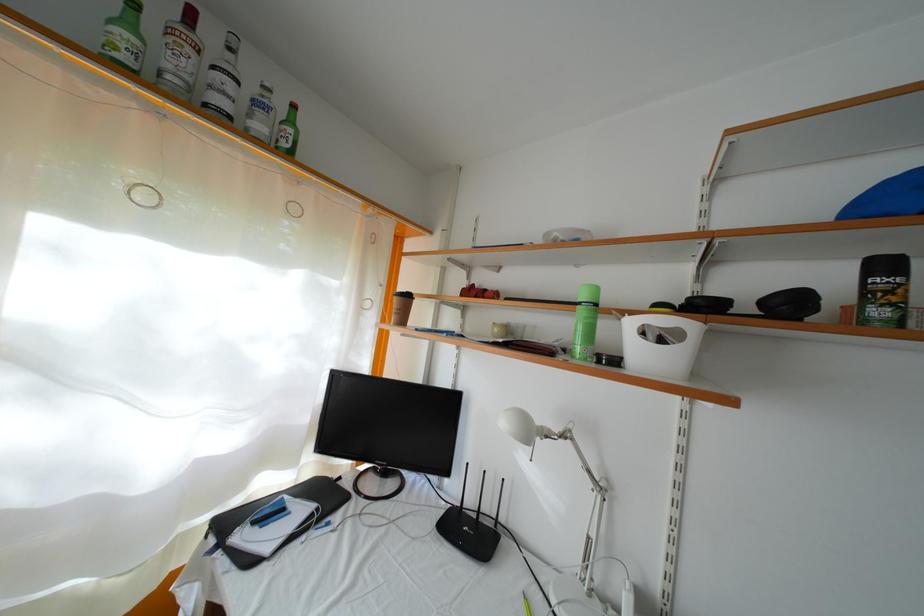
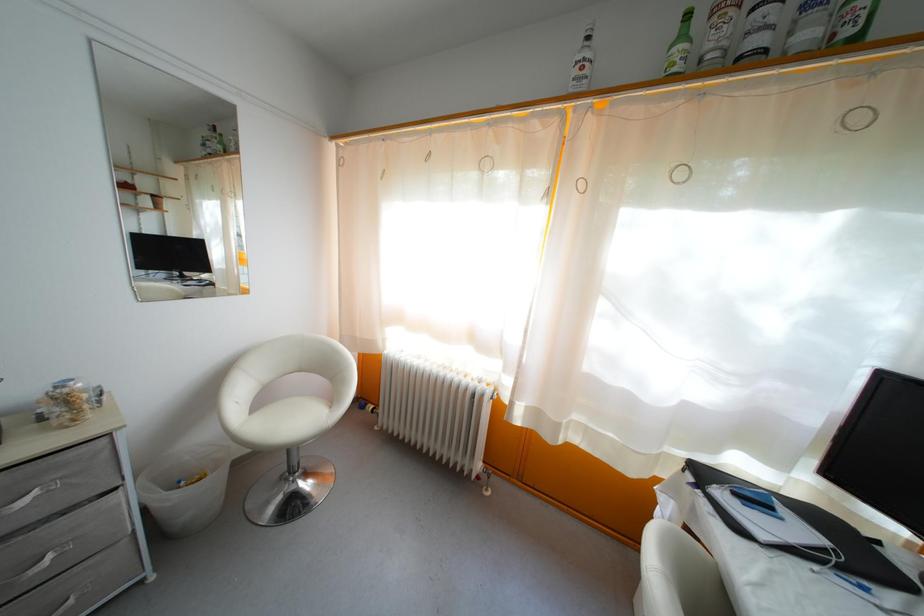
The point at (x=264, y=134) is marked in the first image. Where is the corresponding point in the second image?

(812, 42)